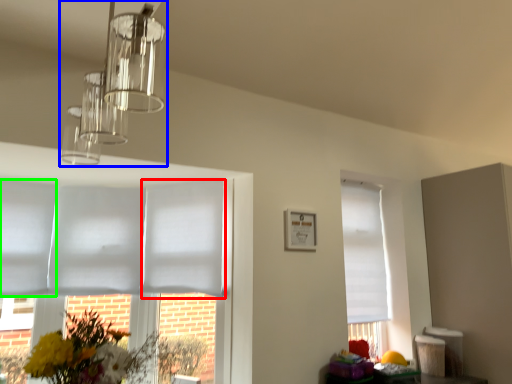
Question: Based on their relative distances, which object is nearer to blind (highlighted by a red box)? Choose from lamp (highlighted by a blue box) and blind (highlighted by a green box).

Choices:
 (A) lamp
 (B) blind

Answer: (B)